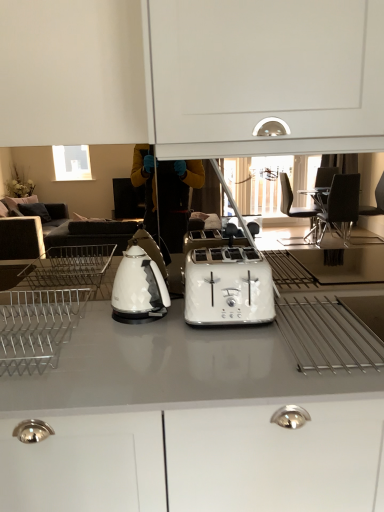
Identify the location of free space in front of white glossy electric kettle at left. (135, 340).